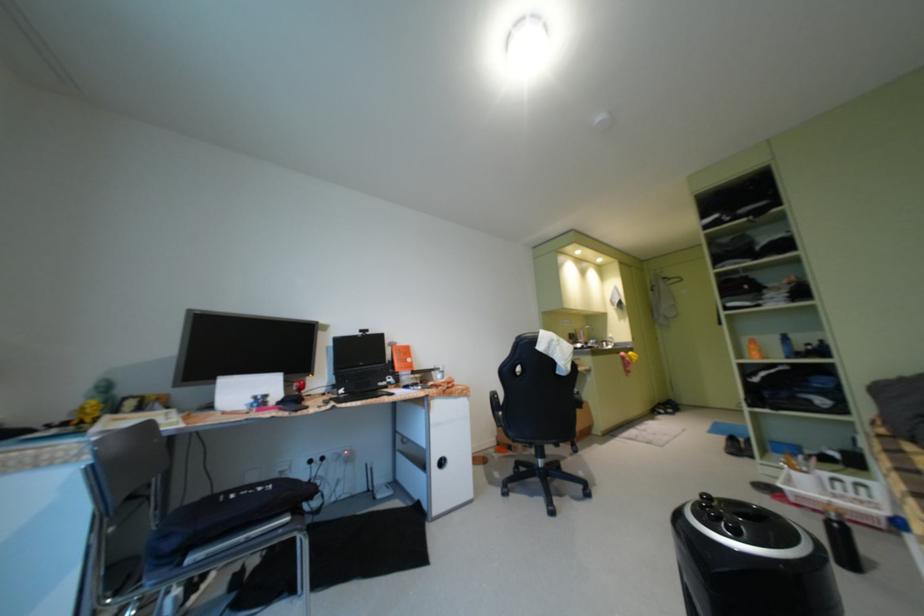
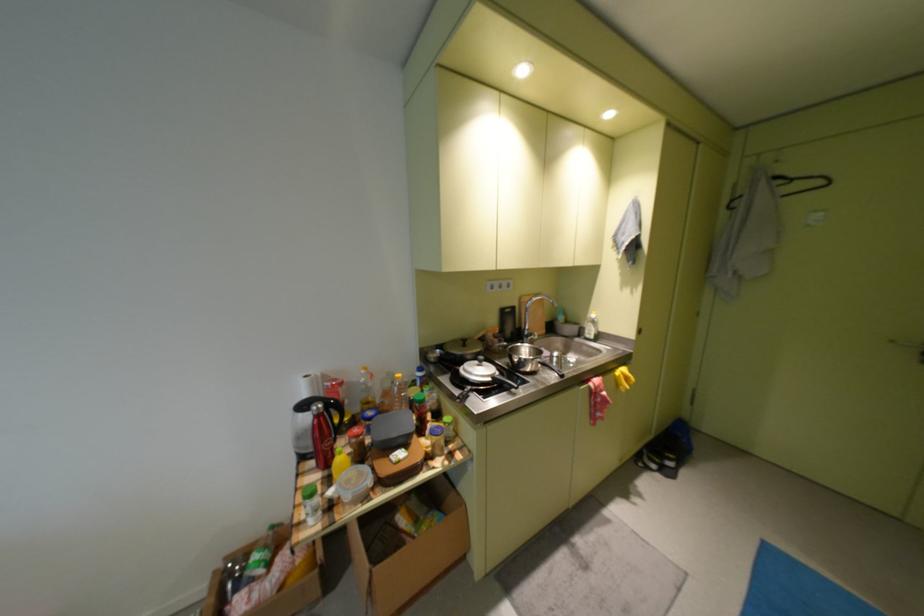
Consider the image. The images are taken continuously from a first-person perspective. In which direction are you moving?

The cameraman moved toward right, forward.